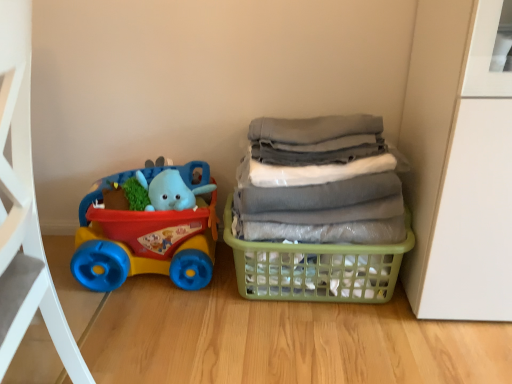
Question: From a real-world perspective, is green plastic basket at right located higher than gray fabric laundry at right?

Choices:
 (A) no
 (B) yes

Answer: (A)

Question: Does green plastic basket at right have a larger size compared to gray fabric laundry at right?

Choices:
 (A) yes
 (B) no

Answer: (B)

Question: Is green plastic basket at right positioned with its back to gray fabric laundry at right?

Choices:
 (A) no
 (B) yes

Answer: (A)

Question: Does green plastic basket at right have a greater height compared to gray fabric laundry at right?

Choices:
 (A) no
 (B) yes

Answer: (A)

Question: Is green plastic basket at right outside of gray fabric laundry at right?

Choices:
 (A) yes
 (B) no

Answer: (A)

Question: Is green plastic basket at right to the right of gray fabric laundry at right from the viewer's perspective?

Choices:
 (A) yes
 (B) no

Answer: (B)

Question: Is gray fabric laundry at right located outside rubberized plastic toy car at left?

Choices:
 (A) no
 (B) yes

Answer: (B)

Question: From the image's perspective, is gray fabric laundry at right on rubberized plastic toy car at left?

Choices:
 (A) no
 (B) yes

Answer: (B)

Question: Can you confirm if gray fabric laundry at right is positioned to the left of rubberized plastic toy car at left?

Choices:
 (A) yes
 (B) no

Answer: (B)

Question: From the image's perspective, is gray fabric laundry at right beneath rubberized plastic toy car at left?

Choices:
 (A) no
 (B) yes

Answer: (A)

Question: Is gray fabric laundry at right touching rubberized plastic toy car at left?

Choices:
 (A) no
 (B) yes

Answer: (A)

Question: From a real-world perspective, is gray fabric laundry at right below rubberized plastic toy car at left?

Choices:
 (A) yes
 (B) no

Answer: (B)

Question: Is rubberized plastic toy car at left behind green plastic basket at right?

Choices:
 (A) no
 (B) yes

Answer: (B)